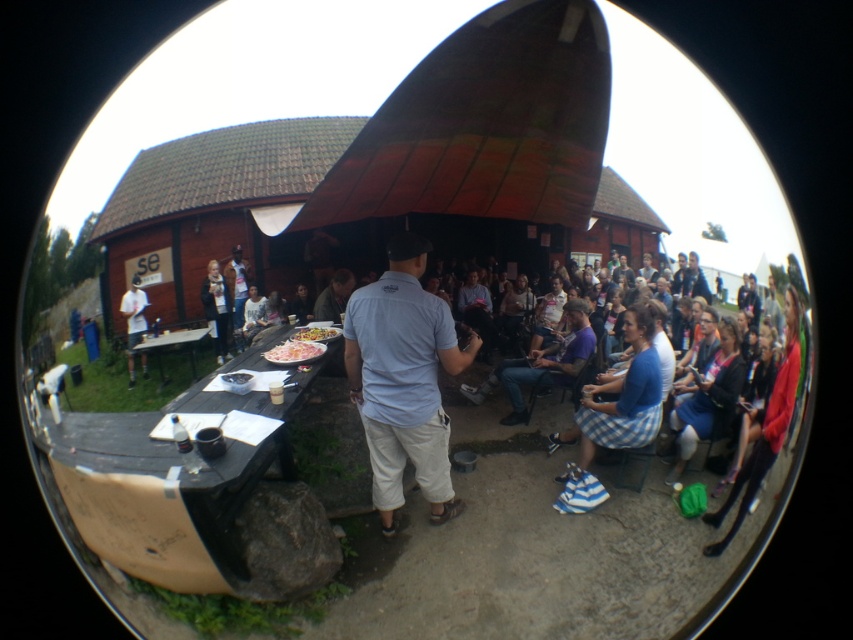
Consider the image. Does light blue cotton shirt at center have a greater width compared to white glossy plate at center?

Correct, the width of light blue cotton shirt at center exceeds that of white glossy plate at center.

The width and height of the screenshot is (853, 640). Describe the element at coordinates (403, 380) in the screenshot. I see `light blue cotton shirt at center` at that location.

The width and height of the screenshot is (853, 640). I want to click on light blue cotton shirt at center, so [403, 380].

Who is more distant from viewer, (421,269) or (131,380)?

The point (131,380) is more distant.

The image size is (853, 640). What do you see at coordinates (403, 380) in the screenshot?
I see `light blue cotton shirt at center` at bounding box center [403, 380].

You are a GUI agent. You are given a task and a screenshot of the screen. Output one action in this format:
    pyautogui.click(x=<x>, y=<y>)
    Task: Click on the light blue cotton shirt at center
    
    Given the screenshot: What is the action you would take?
    403,380

Can you confirm if wooden picnic table at lower left is wider than matte gray shirt at center?

Yes.

Is wooden picnic table at lower left positioned behind matte gray shirt at center?

Yes.

Between point (190, 358) and point (335, 320), which one is positioned behind?

The point (190, 358) is more distant.

Identify the location of wooden picnic table at lower left. (173, 348).